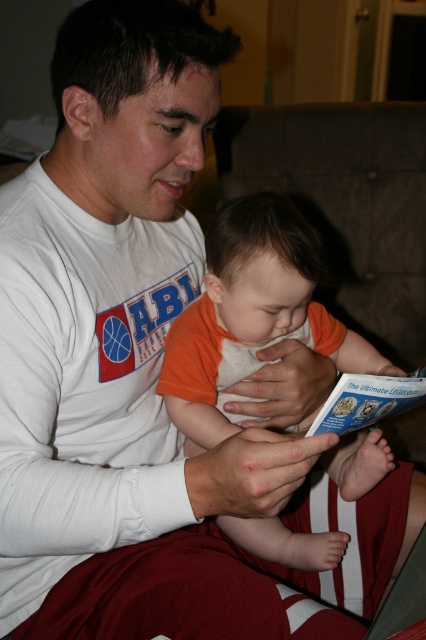
In the scene shown: Between orange cotton shirt at center and blue paper at center, which one has less height?

blue paper at center is shorter.

Who is higher up, orange cotton shirt at center or blue paper at center?

orange cotton shirt at center

Image resolution: width=426 pixels, height=640 pixels. Identify the location of orange cotton shirt at center. (250, 314).